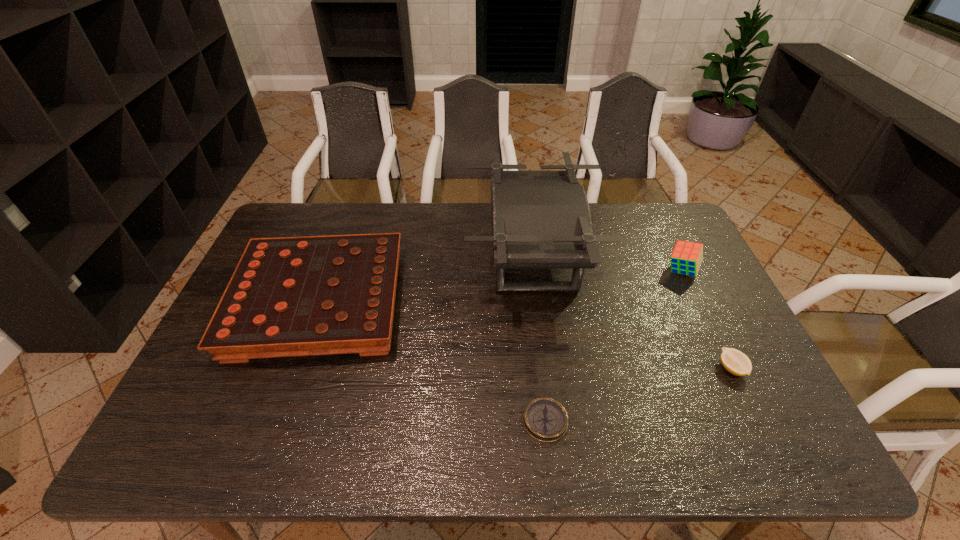
Locate an element on the screen. Image resolution: width=960 pixels, height=540 pixels. free space located on the front of the cube is located at coordinates (707, 322).

Locate an element on the screen. The width and height of the screenshot is (960, 540). vacant space located 0.160m on the front of the leftmost object is located at coordinates (276, 427).

The image size is (960, 540). Identify the location of vacant space situated 0.190m on the left of the lemon. (644, 369).

What are the coordinates of `vacant region located on the right of the compass` in the screenshot? It's located at (659, 421).

This screenshot has width=960, height=540. Find the location of `object located at the far edge`. object located at the far edge is located at coordinates (540, 219).

At what (x,y) coordinates should I click in order to perform the action: click on object present at the near edge. Please return your answer as a coordinate pair (x, y). Image resolution: width=960 pixels, height=540 pixels. Looking at the image, I should click on (545, 419).

The image size is (960, 540). What are the coordinates of `object located in the left edge section of the desktop` in the screenshot? It's located at (315, 295).

The image size is (960, 540). Find the location of `cube that is positioned at the right edge`. cube that is positioned at the right edge is located at coordinates (686, 258).

Find the location of a particular element. lemon that is at the right edge is located at coordinates (734, 361).

Identify the location of vacant space at the far edge. (610, 231).